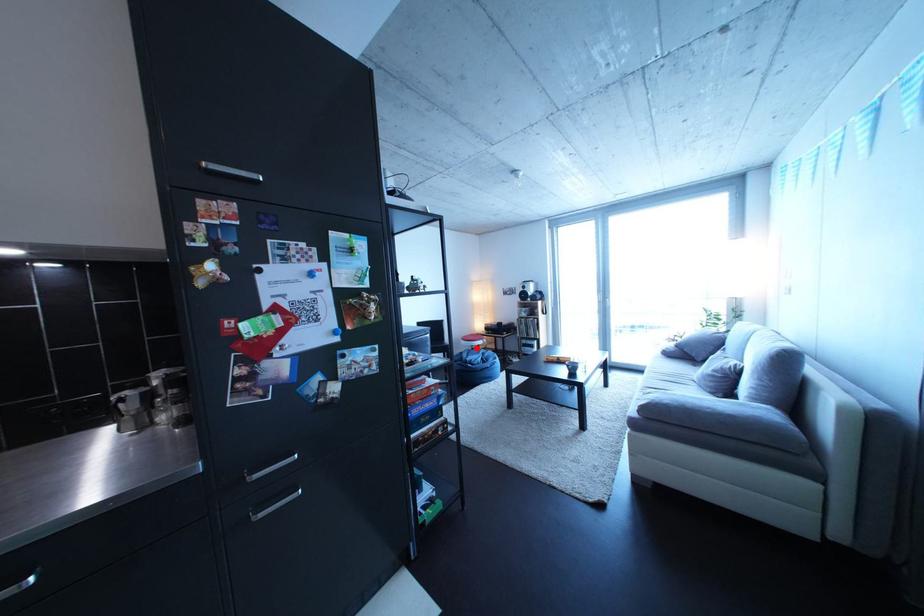
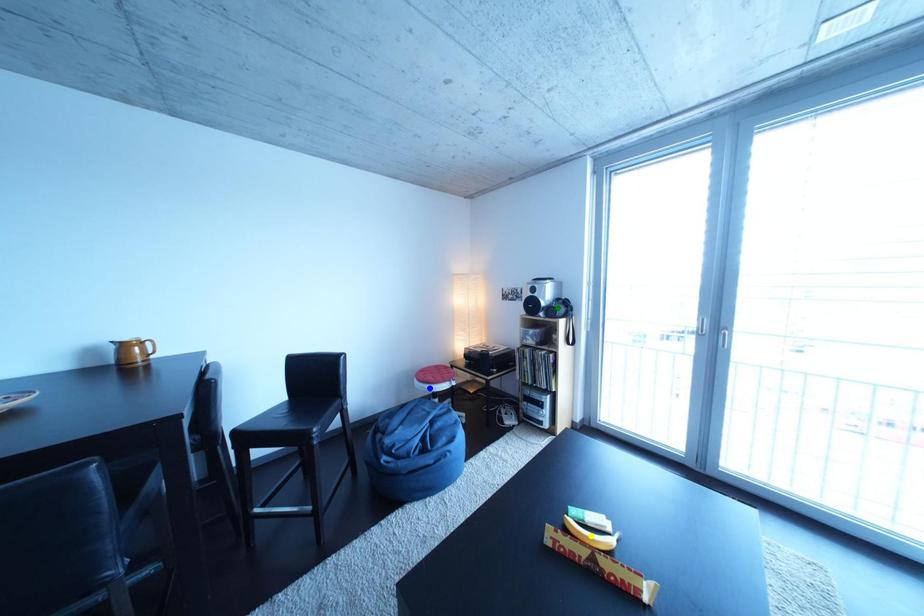
Question: I am providing you with two images of the same scene from different viewpoints. A red point is marked on the first image. You are given multiple points on the second image. Which point in image 2 represents the same 3d spot as the red point in image 1?

Choices:
 (A) green point
 (B) yellow point
 (C) blue point

Answer: (C)